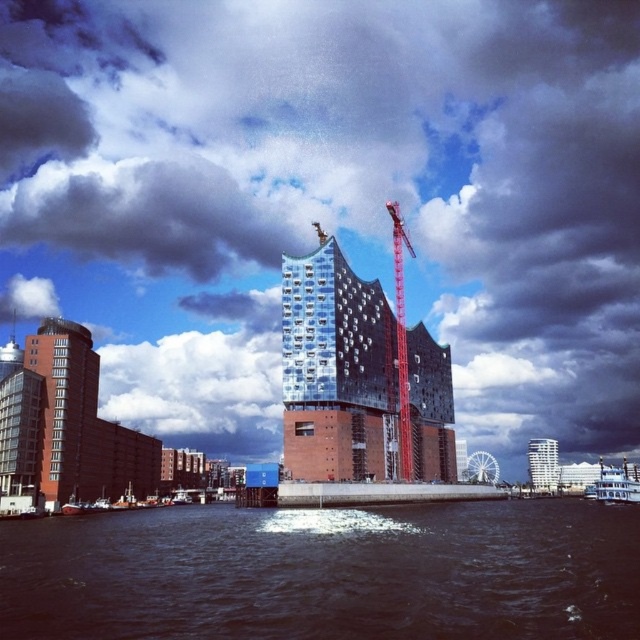
You are standing at the point where the coordinates are (330, 200) in the image. What do you see above you?

The cloudy sky at upper center is located at point (330, 200), so you would see the cloudy sky at upper center above you.

You are an architect observing the waterfront scene. You notice the cloudy sky at upper center and the reflective glass building at center. Which object is positioned higher in the image?

The cloudy sky at upper center is positioned higher than the reflective glass building at center.